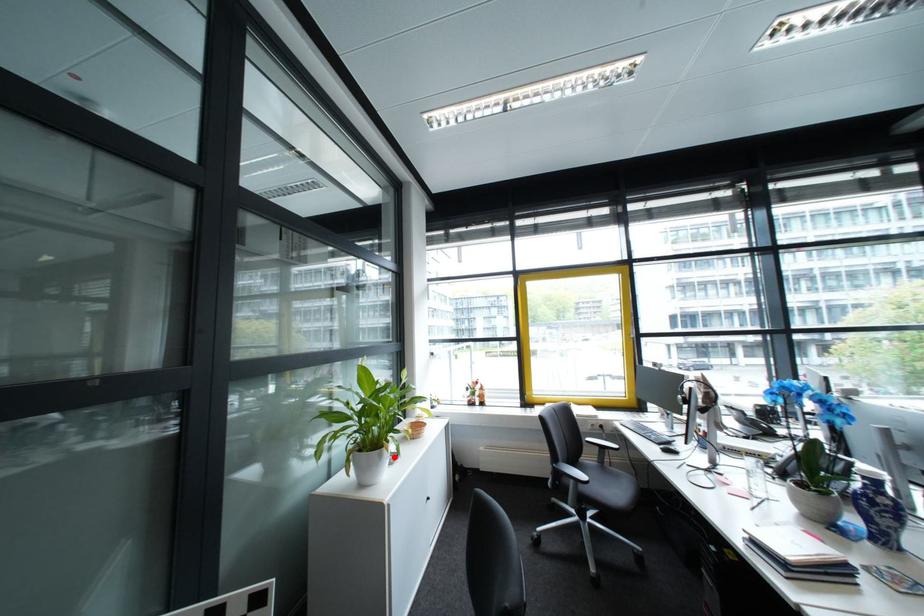
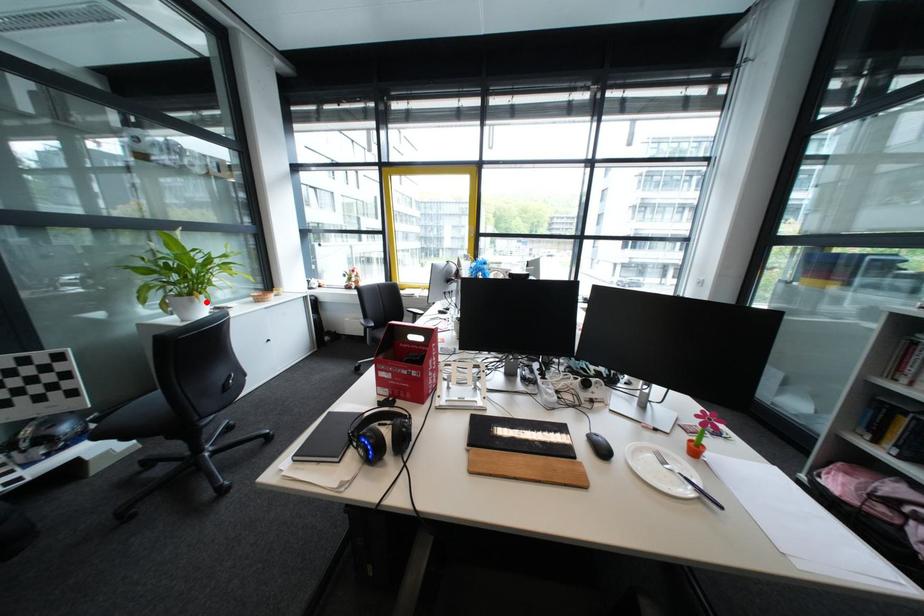
I am providing you with two images of the same scene from different viewpoints. A red point is marked on the first image and another point is marked on the second image. Does the point marked in image1 correspond to the same location as the one in image2?

Yes